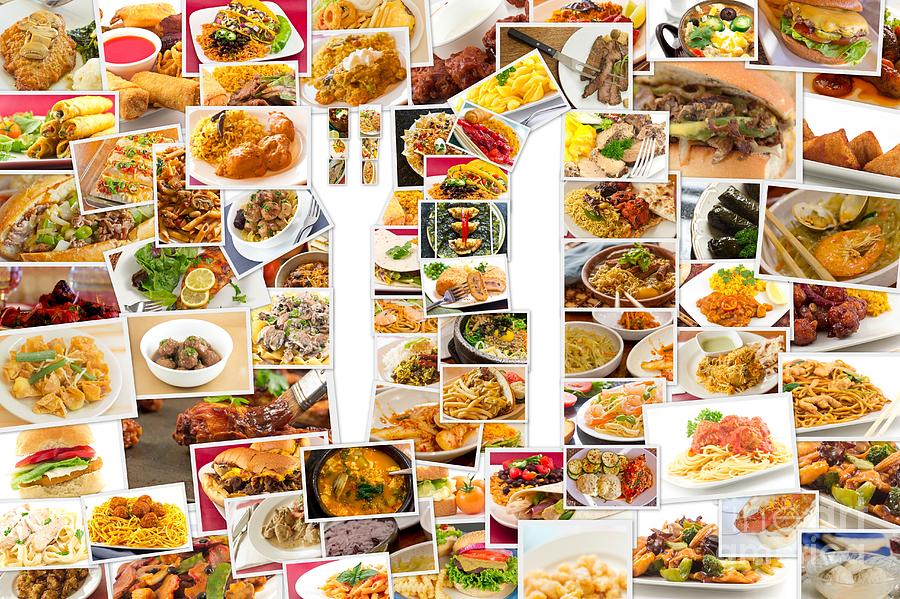
You are a GUI agent. You are given a task and a screenshot of the screen. Output one action in this format:
    pyautogui.click(x=<x>, y=<y>)
    Task: Click on the pictures with eating utensils
    Image resolution: width=900 pixels, height=599 pixels.
    Given the screenshot: What is the action you would take?
    pyautogui.click(x=587, y=57), pyautogui.click(x=641, y=145), pyautogui.click(x=817, y=262), pyautogui.click(x=310, y=210), pyautogui.click(x=459, y=281), pyautogui.click(x=149, y=299), pyautogui.click(x=248, y=533), pyautogui.click(x=627, y=273), pyautogui.click(x=381, y=477)